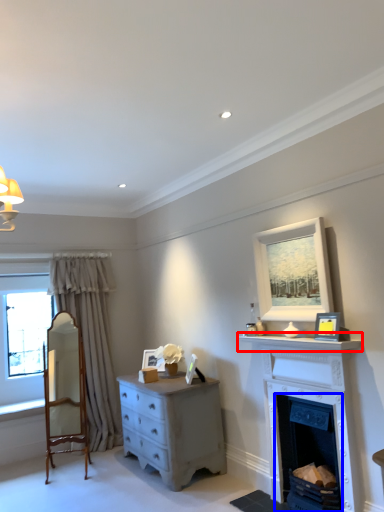
Question: Which object appears farthest to the camera in this image, mantle (highlighted by a red box) or fireplace (highlighted by a blue box)?

Choices:
 (A) mantle
 (B) fireplace

Answer: (B)